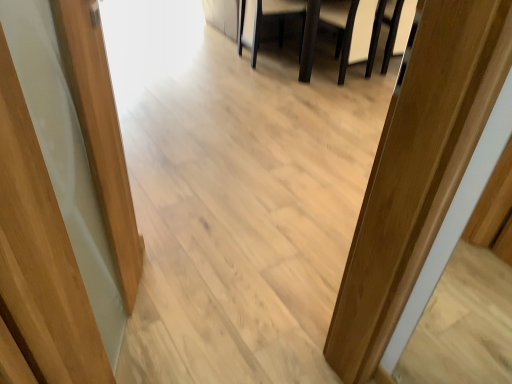
Question: Should I look upward or downward to see dark brown leather armchair at center, the first armchair in the left-to-right sequence?

Choices:
 (A) up
 (B) down

Answer: (A)

Question: From the image's perspective, is dark brown wooden table at center on top of white leather armchair at upper center, which ranks as the second armchair in left-to-right order?

Choices:
 (A) no
 (B) yes

Answer: (B)

Question: Does dark brown wooden table at center lie in front of white leather armchair at upper center, which ranks as the second armchair in left-to-right order?

Choices:
 (A) no
 (B) yes

Answer: (A)

Question: From a real-world perspective, is dark brown wooden table at center on top of white leather armchair at upper center, marked as the first armchair in a right-to-left arrangement?

Choices:
 (A) no
 (B) yes

Answer: (A)

Question: Can white leather armchair at upper center, marked as the first armchair in a right-to-left arrangement, be found inside dark brown wooden table at center?

Choices:
 (A) yes
 (B) no

Answer: (A)

Question: Considering the relative sizes of dark brown wooden table at center and white leather armchair at upper center, which ranks as the second armchair in left-to-right order, in the image provided, is dark brown wooden table at center shorter than white leather armchair at upper center, which ranks as the second armchair in left-to-right order,?

Choices:
 (A) yes
 (B) no

Answer: (A)

Question: Considering the relative sizes of dark brown wooden table at center and white leather armchair at upper center, which ranks as the second armchair in left-to-right order, in the image provided, is dark brown wooden table at center thinner than white leather armchair at upper center, which ranks as the second armchair in left-to-right order,?

Choices:
 (A) yes
 (B) no

Answer: (B)

Question: Are white leather armchair at upper center, marked as the first armchair in a right-to-left arrangement, and dark brown wooden table at center located far from each other?

Choices:
 (A) no
 (B) yes

Answer: (A)

Question: Can you confirm if white leather armchair at upper center, which ranks as the second armchair in left-to-right order, is bigger than dark brown wooden table at center?

Choices:
 (A) yes
 (B) no

Answer: (B)

Question: Does white leather armchair at upper center, which ranks as the second armchair in left-to-right order, turn towards dark brown wooden table at center?

Choices:
 (A) yes
 (B) no

Answer: (A)

Question: Is white leather armchair at upper center, which ranks as the second armchair in left-to-right order, closer to the viewer compared to dark brown wooden table at center?

Choices:
 (A) no
 (B) yes

Answer: (B)

Question: From the image's perspective, is white leather armchair at upper center, which ranks as the second armchair in left-to-right order, above dark brown wooden table at center?

Choices:
 (A) yes
 (B) no

Answer: (B)

Question: Considering the relative positions of white leather armchair at upper center, which ranks as the second armchair in left-to-right order, and dark brown wooden table at center in the image provided, is white leather armchair at upper center, which ranks as the second armchair in left-to-right order, to the left of dark brown wooden table at center from the viewer's perspective?

Choices:
 (A) no
 (B) yes

Answer: (A)

Question: From the image's perspective, is dark brown leather armchair at center, the first armchair in the left-to-right sequence, on top of white leather armchair at upper center, which ranks as the second armchair in left-to-right order?

Choices:
 (A) no
 (B) yes

Answer: (B)